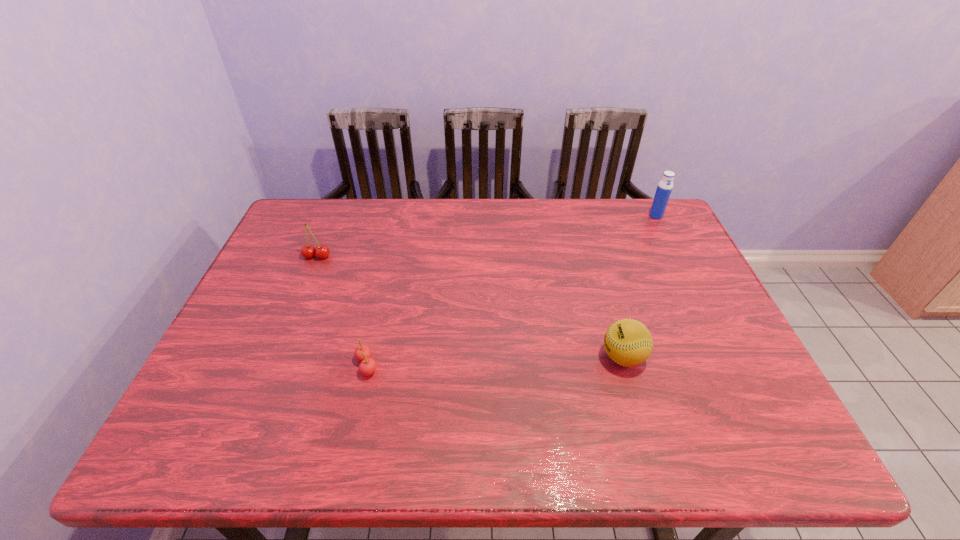
Locate an element on the screen. unoccupied area between the shorter cherry and the water bottle is located at coordinates (512, 291).

Locate an element on the screen. This screenshot has width=960, height=540. free spot between the right cherry and the left cherry is located at coordinates (342, 311).

At what (x,y) coordinates should I click in order to perform the action: click on vacant space that is in between the second object from right to left and the farther cherry. Please return your answer as a coordinate pair (x, y). Looking at the image, I should click on (470, 307).

At what (x,y) coordinates should I click in order to perform the action: click on empty space between the farther cherry and the softball. Please return your answer as a coordinate pair (x, y). Looking at the image, I should click on (470, 307).

At what (x,y) coordinates should I click in order to perform the action: click on vacant space that is in between the shorter cherry and the leftmost object. Please return your answer as a coordinate pair (x, y). This screenshot has width=960, height=540. Looking at the image, I should click on tap(342, 311).

Select which object appears as the third closest to the shortest object. Please provide its 2D coordinates. Your answer should be formatted as a tuple, i.e. [(x, y)], where the tuple contains the x and y coordinates of a point satisfying the conditions above.

[(664, 188)]

Identify the location of the closest object to the leftmost object. The image size is (960, 540). (362, 353).

You are a GUI agent. You are given a task and a screenshot of the screen. Output one action in this format:
    pyautogui.click(x=<x>, y=<y>)
    Task: Click on the blank area in the image that satisfies the following two spatial constraints: 1. on the front side of the rightmost object; 2. on the logo side of the second object from right to left
    Image resolution: width=960 pixels, height=540 pixels.
    Given the screenshot: What is the action you would take?
    pyautogui.click(x=727, y=357)

The width and height of the screenshot is (960, 540). What are the coordinates of `free space that satisfies the following two spatial constraints: 1. with the stems of the leftmost object pointing upwards; 2. on the left side of the shortest object` in the screenshot? It's located at (272, 366).